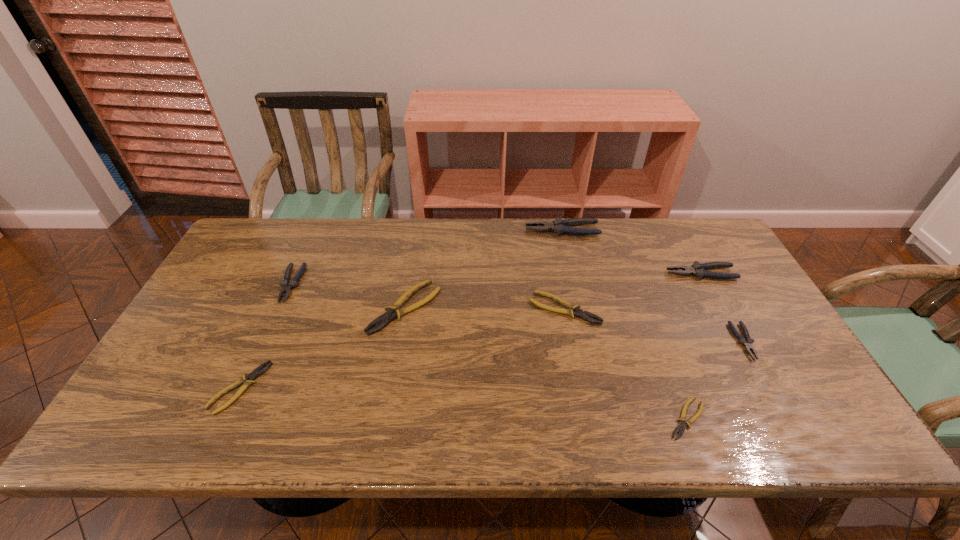
Locate an element on the screen. free space between the smallest gray pliers and the seventh tallest pliers is located at coordinates 492,364.

The width and height of the screenshot is (960, 540). Identify the location of the seventh closest object to the seventh shortest object. (258, 371).

Image resolution: width=960 pixels, height=540 pixels. I want to click on object that is the nearest to the smallest gray pliers, so click(x=699, y=270).

Select which pliers is the second closest to the second tallest pliers. Please provide its 2D coordinates. Your answer should be formatted as a tuple, i.e. [(x, y)], where the tuple contains the x and y coordinates of a point satisfying the conditions above.

[(559, 226)]

Where is `the fifth closest pliers to the nearest gray pliers`? The width and height of the screenshot is (960, 540). the fifth closest pliers to the nearest gray pliers is located at coordinates (394, 311).

Select which gray pliers appears as the fourth closest to the shortest object. Please provide its 2D coordinates. Your answer should be formatted as a tuple, i.e. [(x, y)], where the tuple contains the x and y coordinates of a point satisfying the conditions above.

[(286, 286)]

Identify the location of gray pliers that is the second closest one to the shortest pliers. (699, 270).

Choose which yellow pliers is the fourth nearest neighbor to the second smallest gray pliers. Please provide its 2D coordinates. Your answer should be formatted as a tuple, i.e. [(x, y)], where the tuple contains the x and y coordinates of a point satisfying the conditions above.

[(681, 427)]

Select which yellow pliers is the closest to the sixth pliers from right to left. Please provide its 2D coordinates. Your answer should be formatted as a tuple, i.e. [(x, y)], where the tuple contains the x and y coordinates of a point satisfying the conditions above.

[(258, 371)]

You are a GUI agent. You are given a task and a screenshot of the screen. Output one action in this format:
    pyautogui.click(x=<x>, y=<y>)
    Task: Click on the vacant area in the image that satisfies the following two spatial constraints: 1. at the gripping part of the third object from right to left; 2. on the left side of the farthest pliers
    The image size is (960, 540).
    Given the screenshot: What is the action you would take?
    pyautogui.click(x=605, y=418)